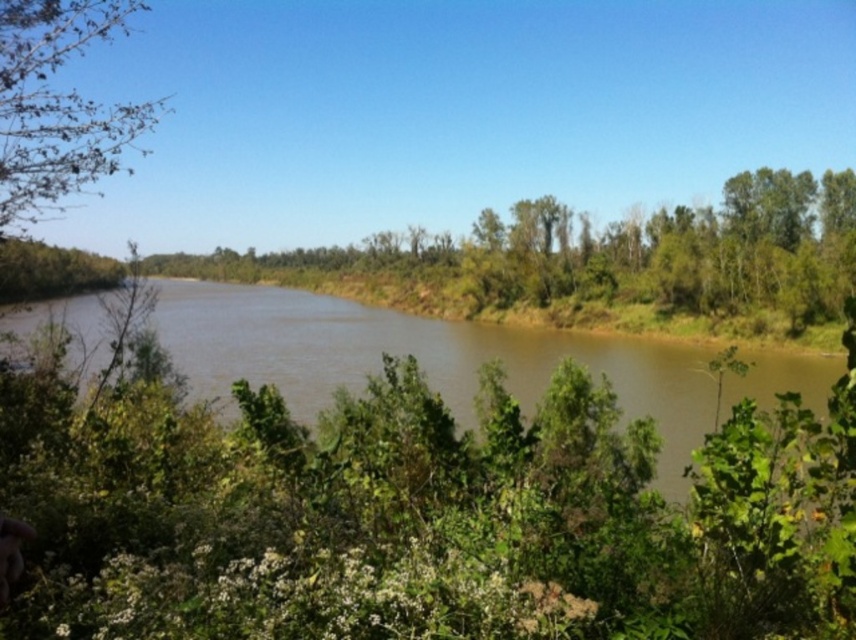
You are standing at the point closest to you in the scene. Which point are you at, point (530, 337) or point (94, 36)?

You are at point (94, 36) because point (530, 337) is behind it, meaning point (94, 36) is closer to you.

You are standing at the origin point of the coordinate system in the image. You want to reach the brown muddy water at center. What are the coordinates you need to move to?

The coordinates to reach the brown muddy water at center are at point 0.561 in the x direction and 0.492 in the y direction.

You are a photographer planning to capture the entire view of the brown muddy water at center and the green leafy tree at upper left in a single frame. Based on their sizes in the scene, which object would require you to adjust your camera angle more to ensure both fit in the frame?

The brown muddy water at center requires more adjustment because its width is larger than the green leafy tree at upper left, so you need to widen your camera angle to accommodate its greater width.